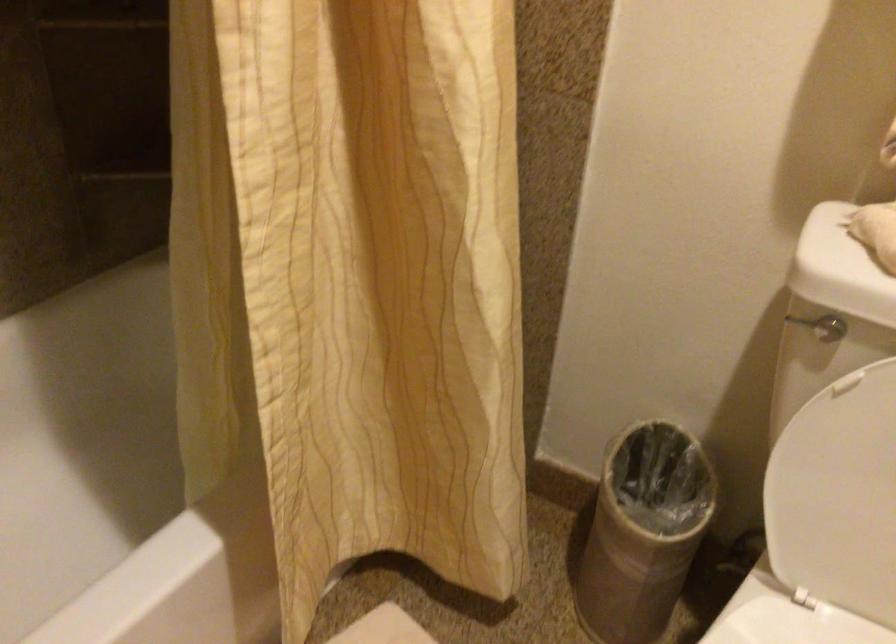
What do you see at coordinates (821, 327) in the screenshot? I see `the toilet flush handle` at bounding box center [821, 327].